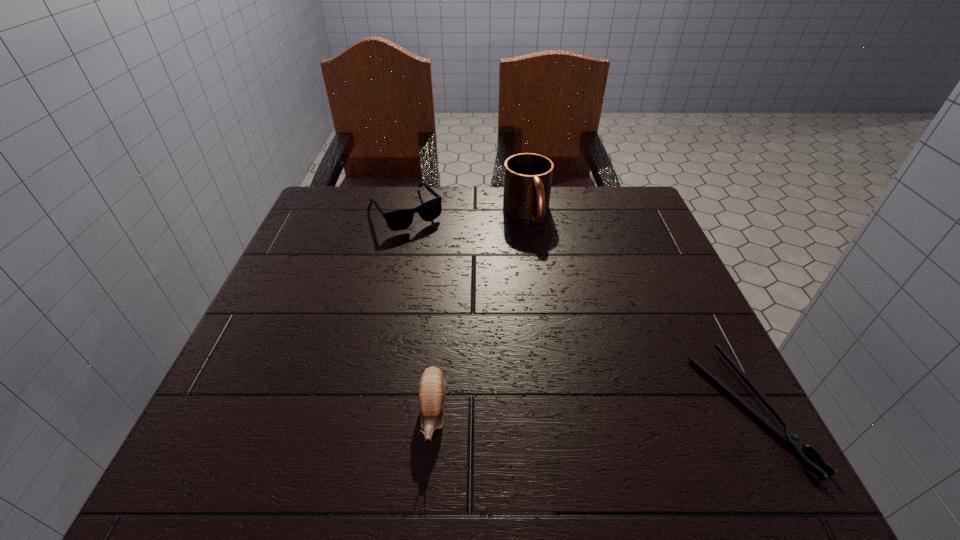
Where is `object that is at the near right corner`? Image resolution: width=960 pixels, height=540 pixels. object that is at the near right corner is located at coordinates (791, 437).

In the image, there is a desktop. Where is `vacant area at the far edge`? vacant area at the far edge is located at coordinates (459, 200).

In the image, there is a desktop. Identify the location of vacant area at the near edge. The width and height of the screenshot is (960, 540). (531, 388).

I want to click on vacant space at the left edge of the desktop, so click(305, 264).

Find the location of a particular element. free space at the right edge is located at coordinates (625, 276).

At what (x,y) coordinates should I click in order to perform the action: click on free space at the far left corner of the desktop. Please return your answer as a coordinate pair (x, y). Looking at the image, I should click on (340, 227).

Locate an element on the screen. This screenshot has height=540, width=960. blank space at the near left corner of the desktop is located at coordinates (255, 404).

Find the location of `vacant space at the far right corner of the desktop`. vacant space at the far right corner of the desktop is located at coordinates coord(597,205).

The height and width of the screenshot is (540, 960). I want to click on free spot between the second shortest object and the escargot, so click(420, 312).

Image resolution: width=960 pixels, height=540 pixels. In order to click on vacant area between the escargot and the tongs in this screenshot , I will do `click(591, 411)`.